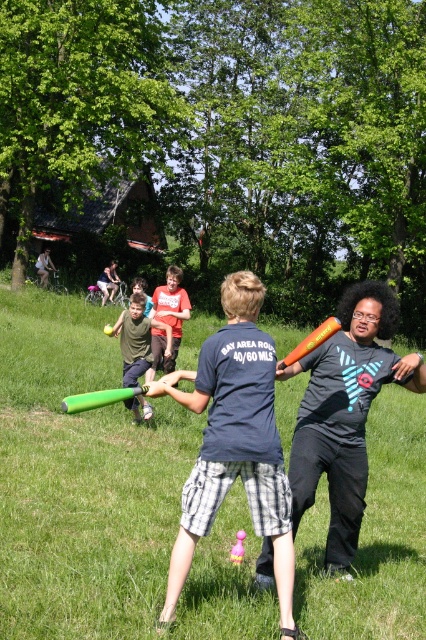
Question: Estimate the real-world distances between objects in this image. Which object is farther from the orange matte baseball bat at center?

Choices:
 (A) green rubber bat at center
 (B) matte blue t-shirt at center
 (C) green foam bat at center
 (D) matte orange bat at center

Answer: (B)

Question: Can you confirm if green foam bat at center is bigger than orange matte baseball bat at center?

Choices:
 (A) no
 (B) yes

Answer: (A)

Question: Can you confirm if green foam bat at center is positioned below orange matte baseball bat at center?

Choices:
 (A) yes
 (B) no

Answer: (A)

Question: Which object is closer to the camera taking this photo?

Choices:
 (A) green rubber bat at center
 (B) matte orange bat at center

Answer: (A)

Question: Which of the following is the closest to the observer?

Choices:
 (A) (86, 408)
 (B) (264, 404)

Answer: (B)

Question: Is matte blue t-shirt at center wider than matte orange bat at center?

Choices:
 (A) no
 (B) yes

Answer: (B)